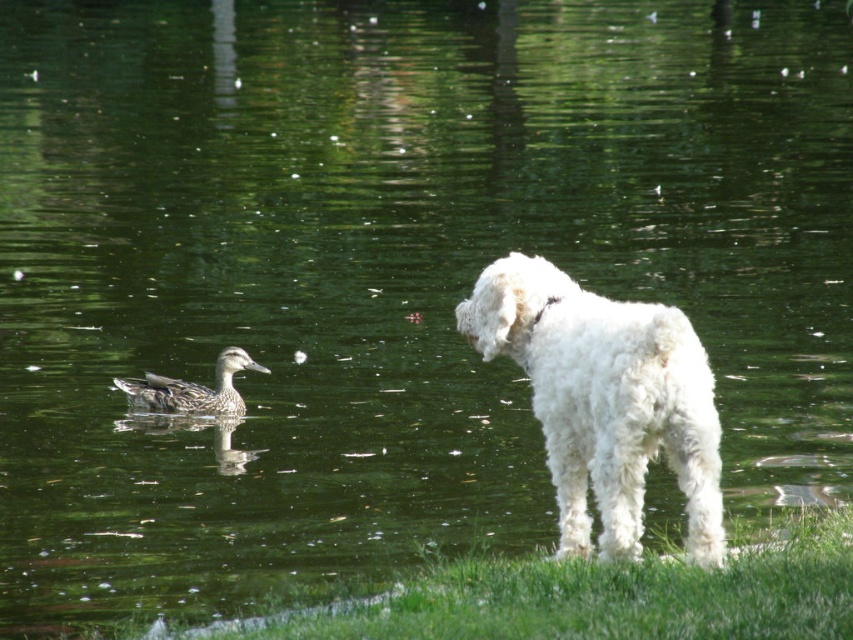
Consider the image. Which is more to the left, green grass at lower right or brown speckled duck at left?

Positioned to the left is brown speckled duck at left.

Does point (554, 602) come farther from viewer compared to point (215, 392)?

No, (554, 602) is in front of (215, 392).

Identify the location of green grass at lower right. The width and height of the screenshot is (853, 640). (601, 596).

Does white fluffy dog at center appear over green grass at lower right?

Yes, white fluffy dog at center is above green grass at lower right.

Is white fluffy dog at center behind green grass at lower right?

Yes, white fluffy dog at center is behind green grass at lower right.

This screenshot has height=640, width=853. Identify the location of white fluffy dog at center. (605, 401).

Which is in front, point (560, 472) or point (158, 401)?

Positioned in front is point (560, 472).

Does white fluffy dog at center have a greater width compared to brown speckled duck at left?

No, white fluffy dog at center is not wider than brown speckled duck at left.

Which is in front, point (676, 428) or point (233, 371)?

Point (676, 428) is in front.

Where is `white fluffy dog at center`? The height and width of the screenshot is (640, 853). white fluffy dog at center is located at coordinates (605, 401).